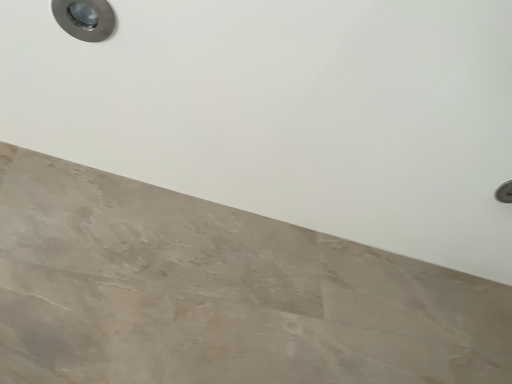
In order to face brushed metal light fixture at upper left, should I rotate leftwards or rightwards?

To align with it, rotate left about 21.691°.

Image resolution: width=512 pixels, height=384 pixels. What do you see at coordinates (85, 18) in the screenshot?
I see `brushed metal light fixture at upper left` at bounding box center [85, 18].

Find the location of `brushed metal light fixture at upper left`. brushed metal light fixture at upper left is located at coordinates (85, 18).

In order to click on brushed metal light fixture at upper left in this screenshot , I will do `click(85, 18)`.